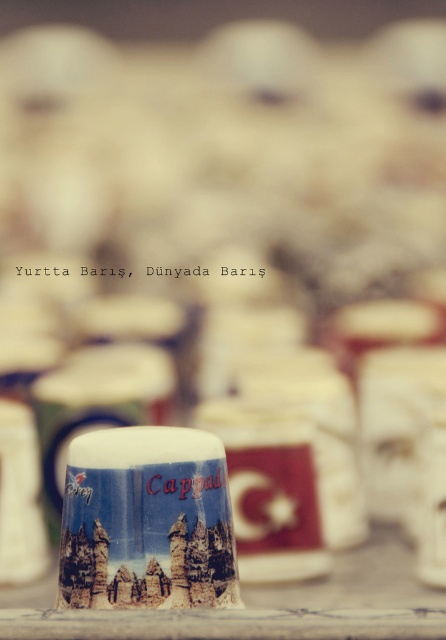
Question: Is blue glossy mug at center to the right of wooden table at center from the viewer's perspective?

Choices:
 (A) no
 (B) yes

Answer: (A)

Question: Which object appears closest to the camera in this image?

Choices:
 (A) matte ceramic mug at center
 (B) wooden table at center
 (C) blue glossy mug at center

Answer: (C)

Question: Does blue glossy mug at center appear under wooden table at center?

Choices:
 (A) no
 (B) yes

Answer: (A)

Question: Which object is farther from the camera taking this photo?

Choices:
 (A) matte ceramic mug at center
 (B) wooden table at center

Answer: (A)

Question: Can you confirm if blue glossy mug at center is thinner than wooden table at center?

Choices:
 (A) no
 (B) yes

Answer: (B)

Question: Among these objects, which one is nearest to the camera?

Choices:
 (A) matte ceramic mug at center
 (B) blue glossy mug at center
 (C) wooden table at center

Answer: (B)